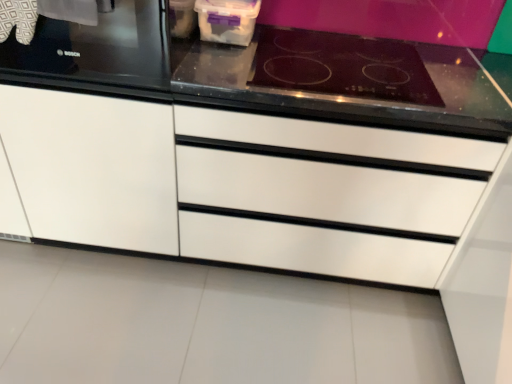
Question: Does black glass cooktop at upper right appear on the left side of white glossy drawer at center?

Choices:
 (A) yes
 (B) no

Answer: (B)

Question: Is black glass cooktop at upper right outside of white glossy drawer at center?

Choices:
 (A) yes
 (B) no

Answer: (B)

Question: Is black glass cooktop at upper right not near white glossy drawer at center?

Choices:
 (A) yes
 (B) no

Answer: (B)

Question: Is black glass cooktop at upper right oriented away from white glossy drawer at center?

Choices:
 (A) yes
 (B) no

Answer: (B)

Question: Is black glass cooktop at upper right aimed at white glossy drawer at center?

Choices:
 (A) yes
 (B) no

Answer: (B)

Question: Does black glass cooktop at upper right have a larger size compared to white glossy drawer at center?

Choices:
 (A) yes
 (B) no

Answer: (B)

Question: Is black glass cooktop at upper right facing away from black glass stove at upper left?

Choices:
 (A) yes
 (B) no

Answer: (B)

Question: From a real-world perspective, is black glass cooktop at upper right on black glass stove at upper left?

Choices:
 (A) no
 (B) yes

Answer: (A)

Question: Is black glass cooktop at upper right outside of black glass stove at upper left?

Choices:
 (A) no
 (B) yes

Answer: (B)

Question: Is black glass cooktop at upper right oriented towards black glass stove at upper left?

Choices:
 (A) yes
 (B) no

Answer: (B)

Question: Is black glass cooktop at upper right not near black glass stove at upper left?

Choices:
 (A) yes
 (B) no

Answer: (B)

Question: Does black glass cooktop at upper right come behind black glass stove at upper left?

Choices:
 (A) yes
 (B) no

Answer: (A)

Question: Is black glass stove at upper left not inside white matte cabinet at left?

Choices:
 (A) no
 (B) yes

Answer: (A)